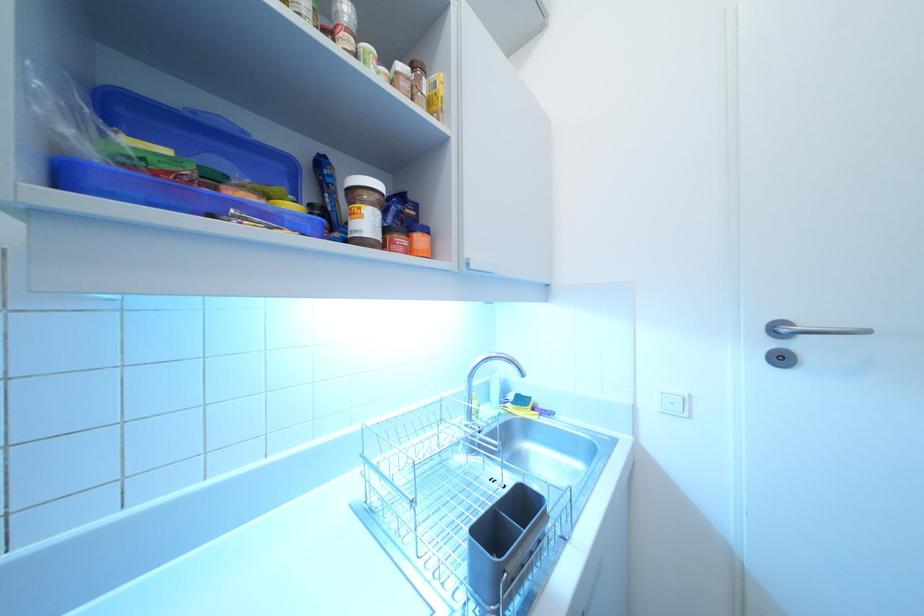
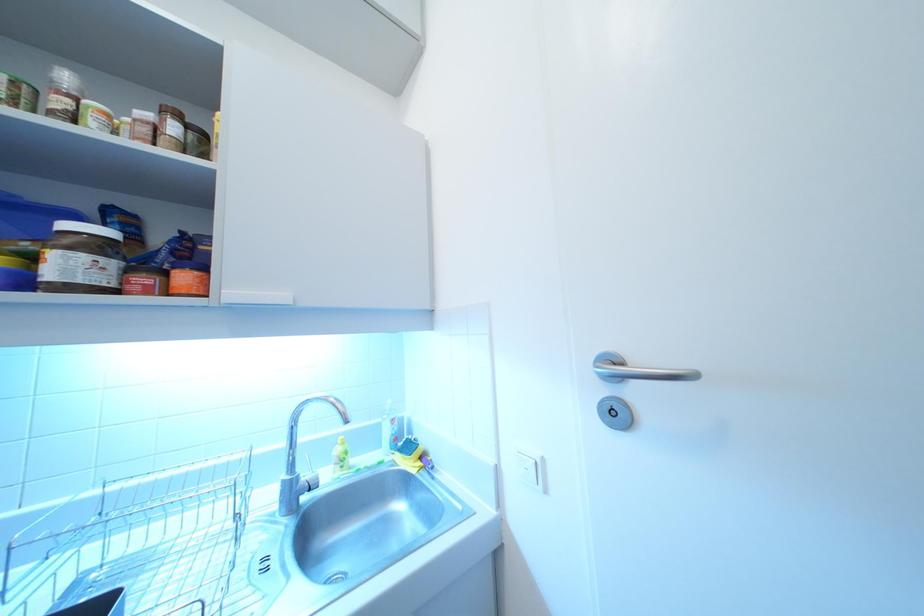
Question: What movement of the cameraman would produce the second image?

Choices:
 (A) Left
 (B) Right
 (C) Forward
 (D) Backward

Answer: (B)